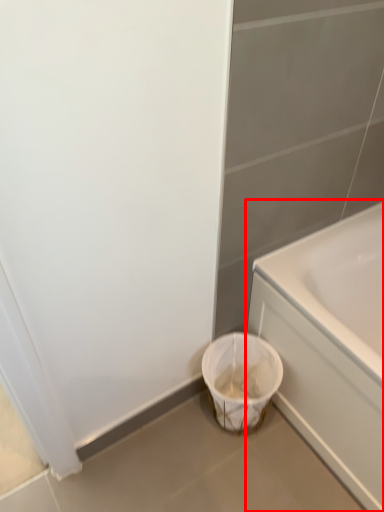
Question: Considering the relative positions of bathtub (annotated by the red box) and laundry basket in the image provided, where is bathtub (annotated by the red box) located with respect to the staircase?

Choices:
 (A) right
 (B) left

Answer: (A)